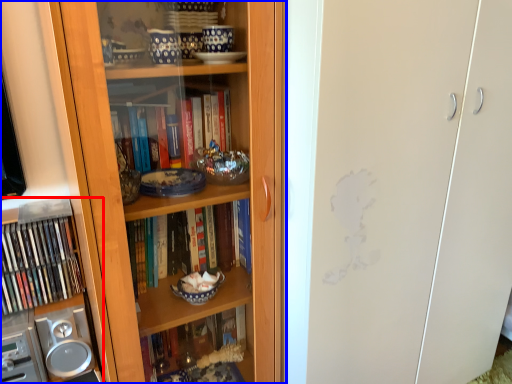
Question: Among these objects, which one is nearest to the camera, cabinet (highlighted by a red box) or bookcase (highlighted by a blue box)?

Choices:
 (A) cabinet
 (B) bookcase

Answer: (B)